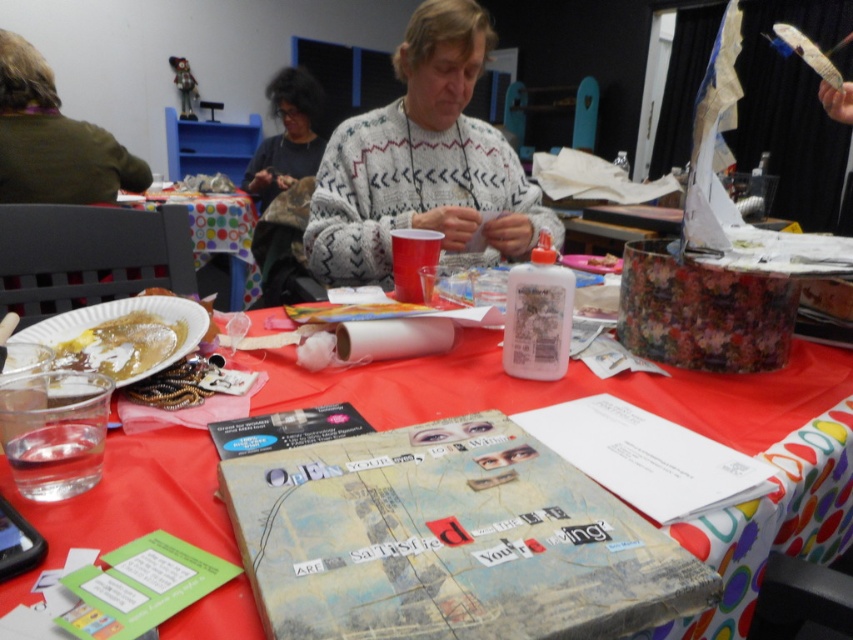
Between textured paper collage at center and red polka dot tablecloth at center, which one has more height?

Standing taller between the two is red polka dot tablecloth at center.

Is point (209, 470) in front of point (144, 204)?

Yes, point (209, 470) is closer to viewer.

Where is `textured paper collage at center`? The height and width of the screenshot is (640, 853). textured paper collage at center is located at coordinates (656, 413).

Between red polka dot tablecloth at center and yellowish matte pancake at lower left, which one has less height?

yellowish matte pancake at lower left

Is point (204, 220) closer to camera compared to point (154, 353)?

No, (204, 220) is behind (154, 353).

Does point (250, 225) come closer to viewer compared to point (112, 352)?

No, it is not.

Where is `red polka dot tablecloth at center`? The width and height of the screenshot is (853, 640). red polka dot tablecloth at center is located at coordinates (216, 236).

Between textured paper collage at center and brown fuzzy sweater at upper left, which one is positioned higher?

brown fuzzy sweater at upper left is above.

Between point (793, 401) and point (74, 176), which one is positioned behind?

The point (74, 176) is behind.

You are a GUI agent. You are given a task and a screenshot of the screen. Output one action in this format:
    pyautogui.click(x=<x>, y=<y>)
    Task: Click on the textured paper collage at center
    
    Given the screenshot: What is the action you would take?
    pyautogui.click(x=656, y=413)